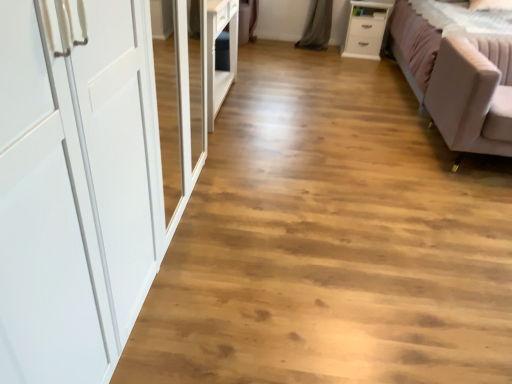
Question: Would you say matte white wardrobe at left is outside light pink fabric studio couch at right?

Choices:
 (A) no
 (B) yes

Answer: (B)

Question: From a real-world perspective, is matte white wardrobe at left below light pink fabric studio couch at right?

Choices:
 (A) yes
 (B) no

Answer: (A)

Question: Is matte white wardrobe at left smaller than light pink fabric studio couch at right?

Choices:
 (A) yes
 (B) no

Answer: (A)

Question: Can you confirm if matte white wardrobe at left is shorter than light pink fabric studio couch at right?

Choices:
 (A) yes
 (B) no

Answer: (A)

Question: Is matte white wardrobe at left at the left side of light pink fabric studio couch at right?

Choices:
 (A) yes
 (B) no

Answer: (A)

Question: Based on their sizes in the image, would you say matte white wardrobe at left is bigger or smaller than white glossy chest of drawers at upper right?

Choices:
 (A) big
 (B) small

Answer: (A)

Question: Choose the correct answer: Is matte white wardrobe at left inside white glossy chest of drawers at upper right or outside it?

Choices:
 (A) outside
 (B) inside

Answer: (A)

Question: From a real-world perspective, is matte white wardrobe at left positioned above or below white glossy chest of drawers at upper right?

Choices:
 (A) below
 (B) above

Answer: (A)

Question: Is matte white wardrobe at left wider or thinner than white glossy chest of drawers at upper right?

Choices:
 (A) thin
 (B) wide

Answer: (B)

Question: From the image's perspective, is matte white wardrobe at left located above or below light pink fabric studio couch at right?

Choices:
 (A) above
 (B) below

Answer: (B)

Question: In terms of size, does matte white wardrobe at left appear bigger or smaller than light pink fabric studio couch at right?

Choices:
 (A) small
 (B) big

Answer: (A)

Question: Relative to light pink fabric studio couch at right, is matte white wardrobe at left in front or behind?

Choices:
 (A) front
 (B) behind

Answer: (A)

Question: In terms of height, does matte white wardrobe at left look taller or shorter compared to light pink fabric studio couch at right?

Choices:
 (A) short
 (B) tall

Answer: (A)

Question: Is white glossy chest of drawers at upper right bigger or smaller than light pink fabric studio couch at right?

Choices:
 (A) big
 (B) small

Answer: (B)

Question: Looking at their shapes, would you say white glossy chest of drawers at upper right is wider or thinner than light pink fabric studio couch at right?

Choices:
 (A) wide
 (B) thin

Answer: (B)